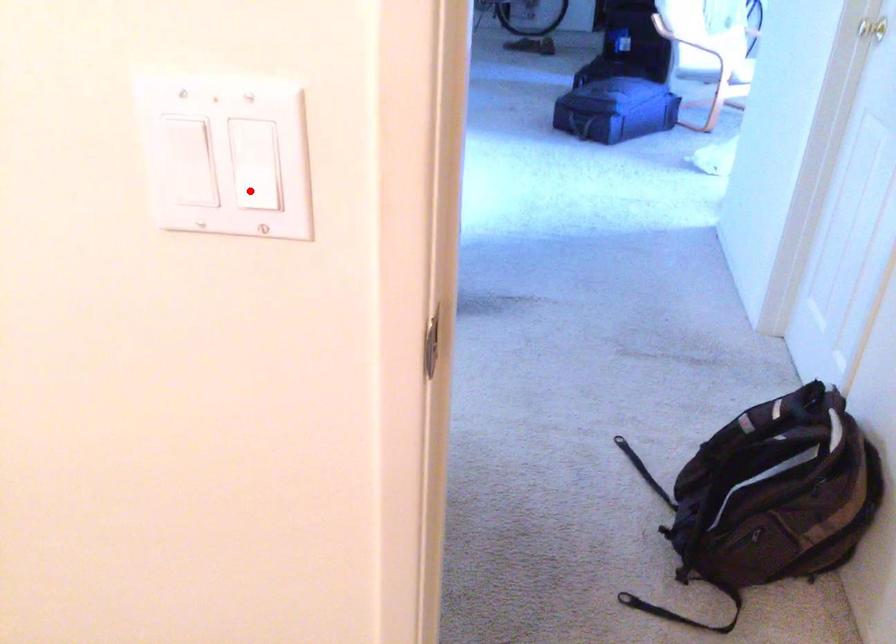
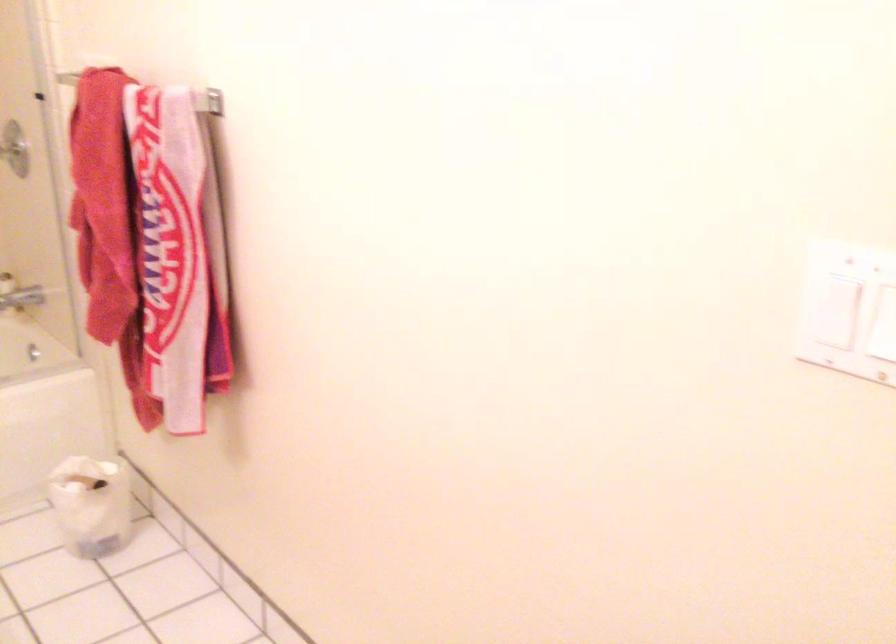
Question: I am providing you with two images of the same scene from different viewpoints. In image1, a red point is highlighted. Considering the same 3D point in image2, which of the following is correct?

Choices:
 (A) It is closer
 (B) It is farther

Answer: (B)